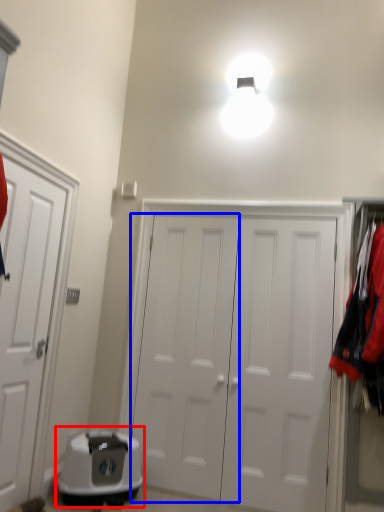
Question: Which point is closer to the camera, appliance (highlighted by a red box) or door (highlighted by a blue box)?

Choices:
 (A) appliance
 (B) door

Answer: (A)